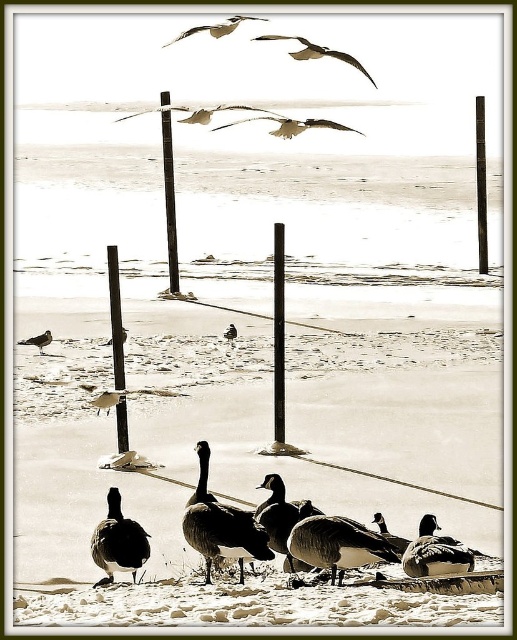
You are an ornithologist observing the ducks in the winter scene. You notice the silhouette feathered duck at lower left and the brown feathered duck at center. Which duck is positioned lower in the image?

The silhouette feathered duck at lower left is positioned lower than the brown feathered duck at center.

You are an ornithologist observing the winter scene. You notice the silhouette feathered duck at lower left and the brown feathered duck at center. Which duck is wider?

The brown feathered duck at center is wider than the silhouette feathered duck at lower left.